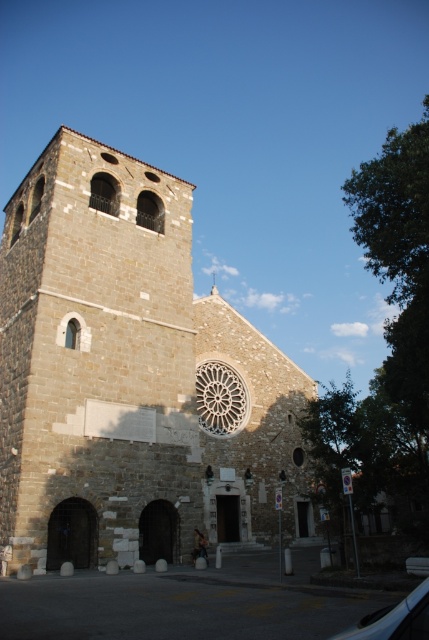
Looking at this image, you are standing in front of the historic stone church and notice a specific point marked at coordinates point (132, 378). Based on the description, can you determine which part of the church this point is located on?

The point (132, 378) is on the brown stone church at center.